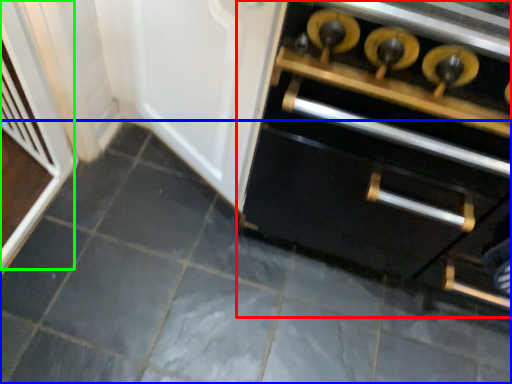
Question: Which object is the farthest from cabinetry (highlighted by a red box)? Choose among these: ceramic tile (highlighted by a blue box) or screen door (highlighted by a green box).

Choices:
 (A) ceramic tile
 (B) screen door

Answer: (B)